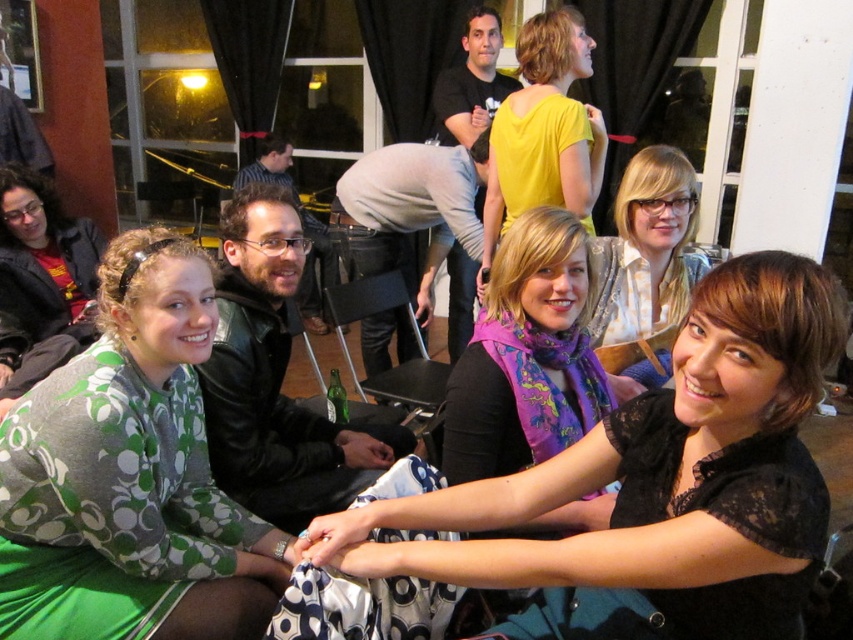
You are a photographer trying to capture a group photo of the black lace shirt at center and the yellow matte shirt at upper center. The camera has a maximum focus range of 5 feet. Will both subjects be in focus if you position the camera to focus on the closer one?

The black lace shirt at center is 5.07 feet from the yellow matte shirt at upper center. If the camera focuses on the closer subject, the distance between them exceeds the 5 feet focus range, so the farther subject may be out of focus.

You are organizing a photo shoot and need to arrange two models wearing the black lace shirt at center and the yellow matte shirt at upper center. Based on their sizes, which model should you place in the front to ensure both are visible?

The black lace shirt at center has a smaller size compared to yellow matte shirt at upper center, so you should place the model wearing the black lace shirt at center in the front to ensure both are visible.